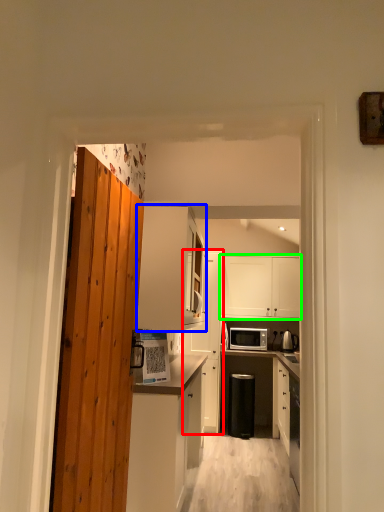
Question: Estimate the real-world distances between objects in this image. Which object is farther from cabinetry (highlighted by a red box), cabinetry (highlighted by a blue box) or cabinetry (highlighted by a green box)?

Choices:
 (A) cabinetry
 (B) cabinetry

Answer: (A)